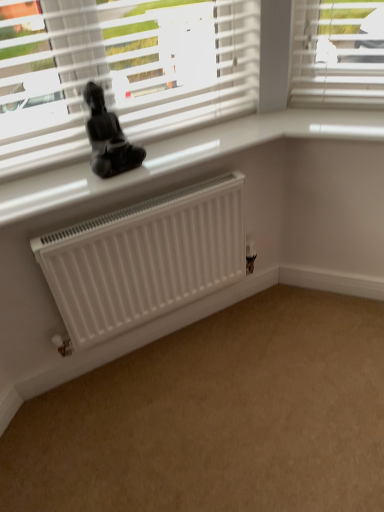
Question: From a real-world perspective, is white matte radiator at lower left located higher than black glossy statue at upper center?

Choices:
 (A) no
 (B) yes

Answer: (A)

Question: Does white matte radiator at lower left have a smaller size compared to black glossy statue at upper center?

Choices:
 (A) yes
 (B) no

Answer: (B)

Question: Is white matte radiator at lower left outside of black glossy statue at upper center?

Choices:
 (A) yes
 (B) no

Answer: (A)

Question: Does white matte radiator at lower left have a greater width compared to black glossy statue at upper center?

Choices:
 (A) yes
 (B) no

Answer: (A)

Question: Considering the relative sizes of white matte radiator at lower left and black glossy statue at upper center in the image provided, is white matte radiator at lower left taller than black glossy statue at upper center?

Choices:
 (A) yes
 (B) no

Answer: (B)

Question: From the image's perspective, would you say white matte radiator at lower left is shown under black glossy statue at upper center?

Choices:
 (A) yes
 (B) no

Answer: (A)

Question: Considering the relative positions of white glossy window sill at upper center and black glossy statue at upper center in the image provided, is white glossy window sill at upper center in front of black glossy statue at upper center?

Choices:
 (A) no
 (B) yes

Answer: (A)

Question: Considering the relative sizes of white glossy window sill at upper center and black glossy statue at upper center in the image provided, is white glossy window sill at upper center taller than black glossy statue at upper center?

Choices:
 (A) yes
 (B) no

Answer: (B)

Question: From a real-world perspective, is white glossy window sill at upper center located beneath black glossy statue at upper center?

Choices:
 (A) yes
 (B) no

Answer: (A)

Question: Can you confirm if white glossy window sill at upper center is bigger than black glossy statue at upper center?

Choices:
 (A) yes
 (B) no

Answer: (A)

Question: Is black glossy statue at upper center located within white glossy window sill at upper center?

Choices:
 (A) yes
 (B) no

Answer: (B)

Question: Considering the relative sizes of white glossy window sill at upper center and black glossy statue at upper center in the image provided, is white glossy window sill at upper center smaller than black glossy statue at upper center?

Choices:
 (A) no
 (B) yes

Answer: (A)

Question: From the image's perspective, is black glossy statue at upper center located beneath white matte radiator at center?

Choices:
 (A) no
 (B) yes

Answer: (A)